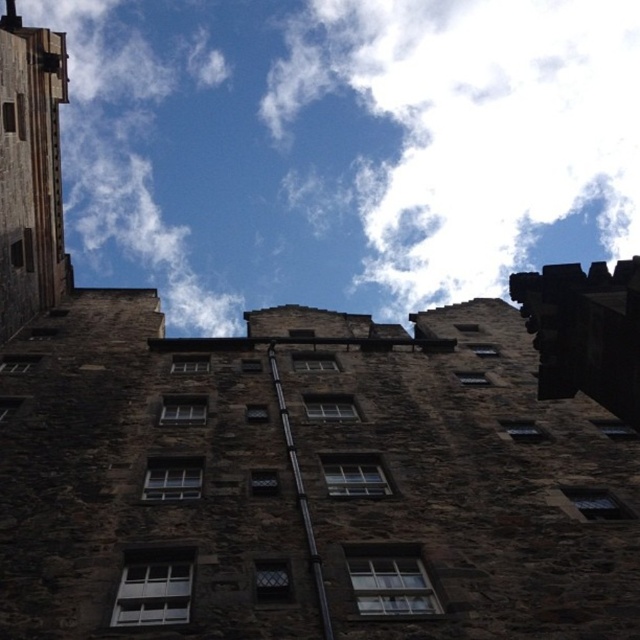
Is white fluffy cloud at upper center further to camera compared to dark stone tower at left?

That is True.

Is white fluffy cloud at upper center to the right of dark stone tower at left from the viewer's perspective?

Correct, you'll find white fluffy cloud at upper center to the right of dark stone tower at left.

Describe the element at coordinates (344, 147) in the screenshot. This screenshot has width=640, height=640. I see `white fluffy cloud at upper center` at that location.

The image size is (640, 640). What are the coordinates of `white fluffy cloud at upper center` in the screenshot? It's located at (344, 147).